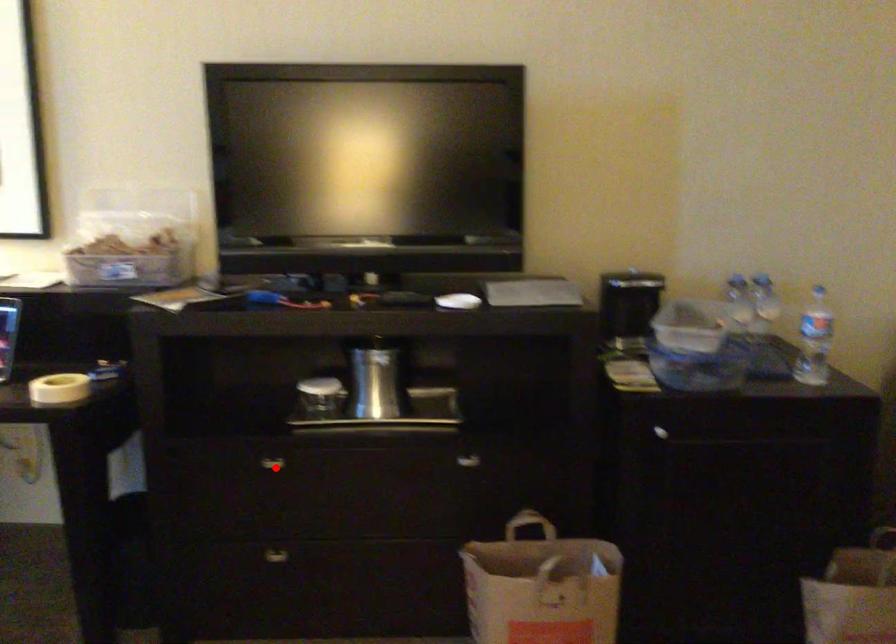
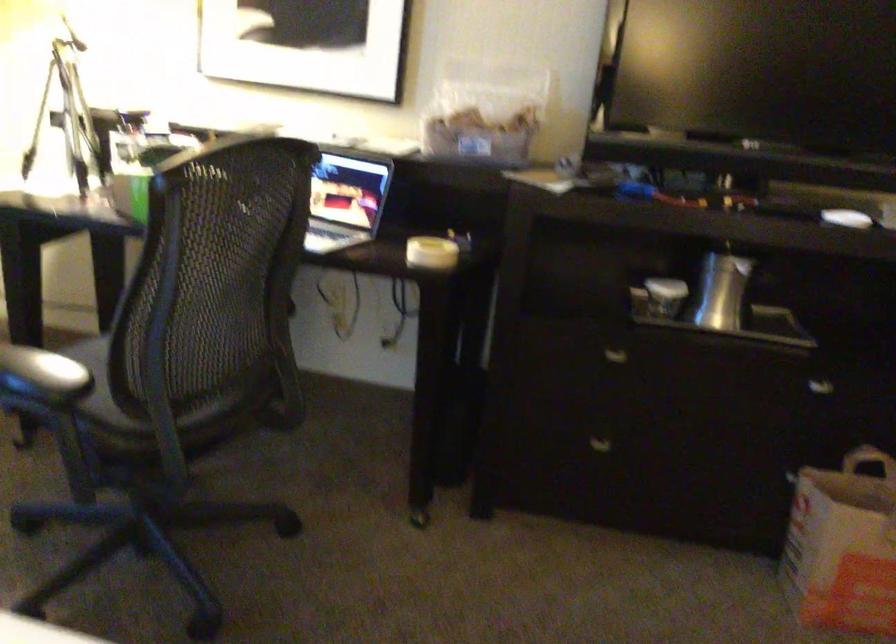
Find the pixel in the second image that matches the highlighted location in the first image.

(615, 357)